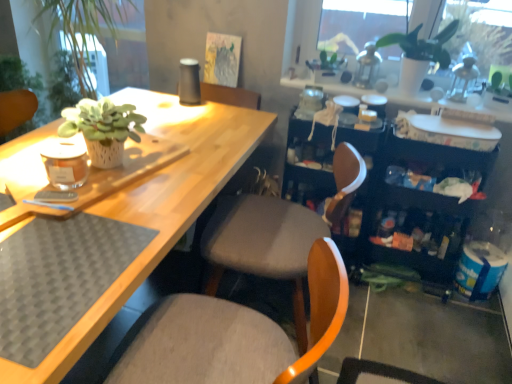
Question: Considering the positions of matte gray cushioned chair at center, the 1th chair positioned from the front, and white matte plant pot at upper right in the image, is matte gray cushioned chair at center, the 1th chair positioned from the front, taller or shorter than white matte plant pot at upper right?

Choices:
 (A) short
 (B) tall

Answer: (B)

Question: From the image's perspective, is matte gray cushioned chair at center, the 2th chair in the back-to-front sequence, above or below white matte plant pot at upper right?

Choices:
 (A) above
 (B) below

Answer: (B)

Question: Estimate the real-world distances between objects in this image. Which object is farther from the fabric cushioned chair at center, the first chair in the back-to-front sequence?

Choices:
 (A) matte gray cushioned chair at center, the 2th chair in the back-to-front sequence
 (B) black plastic bookshelf at right
 (C) white matte plant pot at upper right

Answer: (C)

Question: Considering the real-world distances, which object is farthest from the white matte plant pot at upper right?

Choices:
 (A) fabric cushioned chair at center, the first chair in the back-to-front sequence
 (B) matte gray cushioned chair at center, the 2th chair in the back-to-front sequence
 (C) black plastic bookshelf at right

Answer: (B)